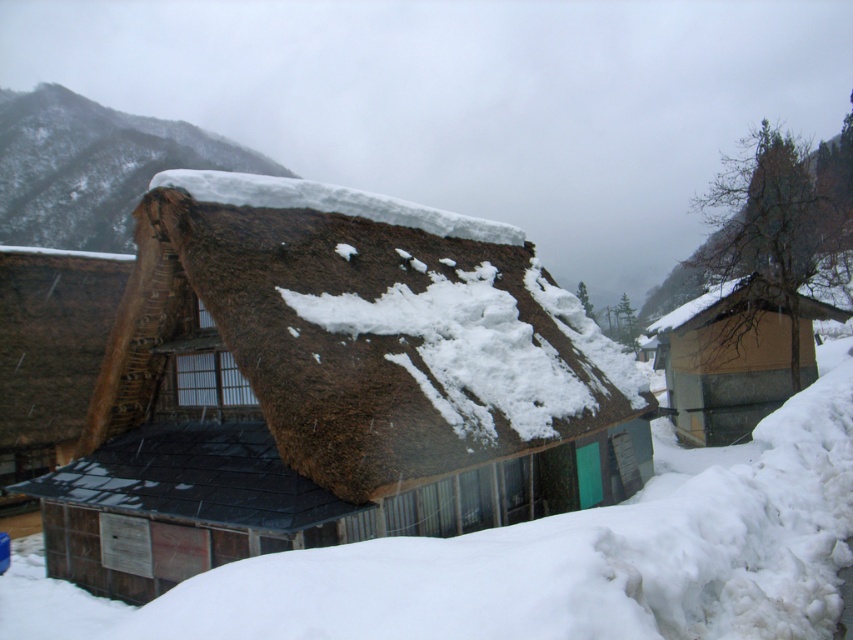
Question: Which point appears closest to the camera in this image?

Choices:
 (A) 140,177
 (B) 758,221
 (C) 757,365

Answer: (C)

Question: Does brown thatch hut at center appear on the left side of bare tree at upper right?

Choices:
 (A) yes
 (B) no

Answer: (A)

Question: Estimate the real-world distances between objects in this image. Which object is farther from the brown thatch hut at center?

Choices:
 (A) brown thatch at upper left
 (B) bare tree at upper right
 (C) wooden cabin at right

Answer: (A)

Question: Which point is farther to the camera?

Choices:
 (A) (462, 452)
 (B) (723, 227)

Answer: (B)

Question: Does bare tree at upper right have a smaller size compared to wooden cabin at right?

Choices:
 (A) yes
 (B) no

Answer: (B)

Question: Does brown thatch hut at center appear over bare tree at upper right?

Choices:
 (A) no
 (B) yes

Answer: (A)